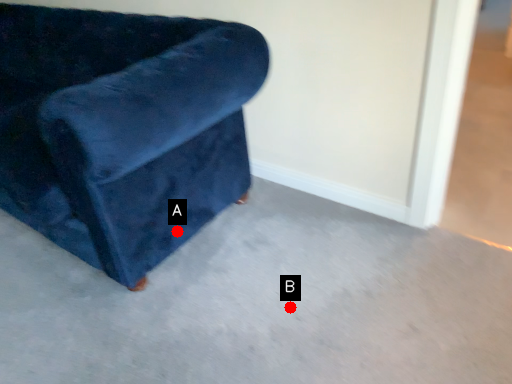
Question: Two points are circled on the image, labeled by A and B beside each circle. Among these points, which one is farthest from the camera?

Choices:
 (A) A is further
 (B) B is further

Answer: (A)